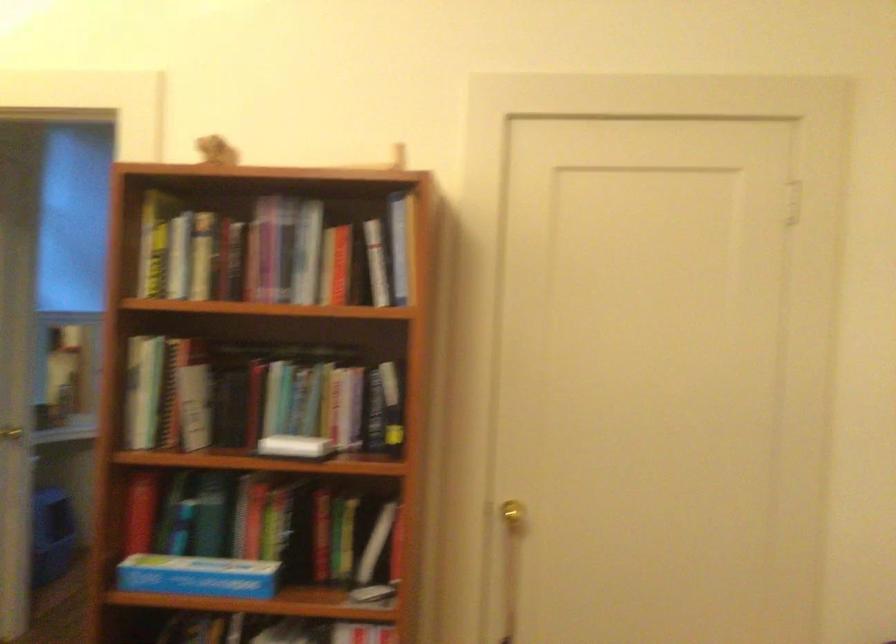
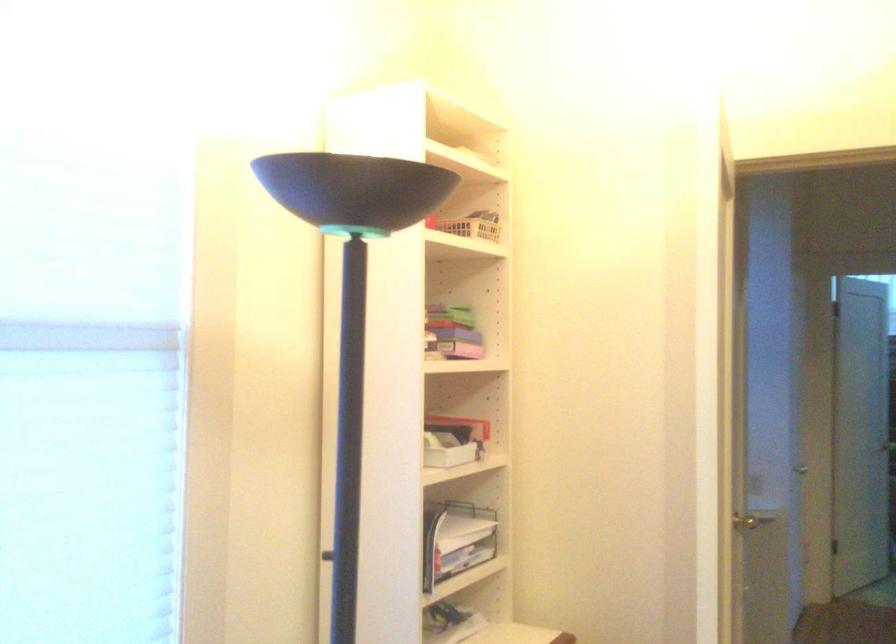
Where in the second image is the point corresponding to pixel 11 433 from the first image?

(773, 531)